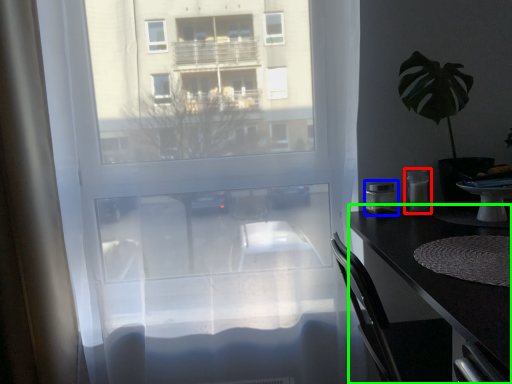
Question: Which is nearer to the appliance (highlighted by a red box)? appliance (highlighted by a blue box) or desk (highlighted by a green box).

Choices:
 (A) appliance
 (B) desk

Answer: (A)